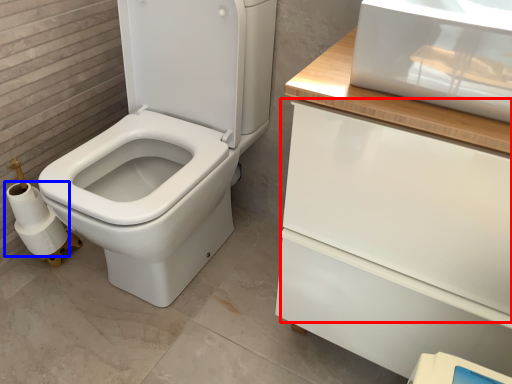
Question: Which of the following is the closest to the observer, drawer (highlighted by a red box) or toilet paper (highlighted by a blue box)?

Choices:
 (A) drawer
 (B) toilet paper

Answer: (A)